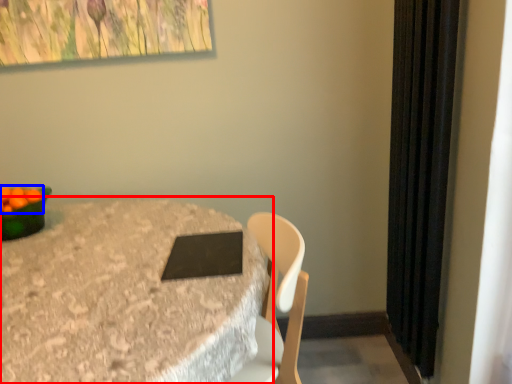
Question: Which of the following is the farthest to the observer, table (highlighted by a red box) or fruit (highlighted by a blue box)?

Choices:
 (A) table
 (B) fruit

Answer: (B)